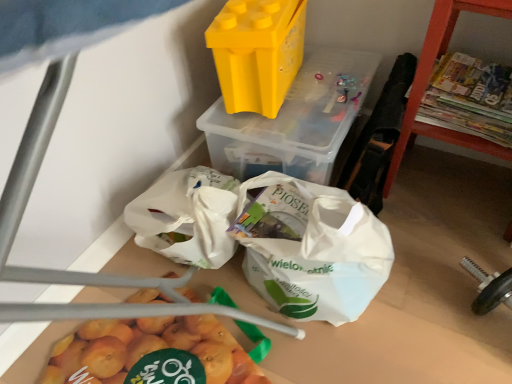
Question: Is yellow plastic container at upper center, the second yoghurt in the left-to-right sequence, positioned with its back to orange wood shelf at right?

Choices:
 (A) yes
 (B) no

Answer: (B)

Question: Are yellow plastic container at upper center, the second yoghurt in the left-to-right sequence, and orange wood shelf at right beside each other?

Choices:
 (A) no
 (B) yes

Answer: (A)

Question: Considering the relative sizes of yellow plastic container at upper center, the second yoghurt in the left-to-right sequence, and orange wood shelf at right in the image provided, is yellow plastic container at upper center, the second yoghurt in the left-to-right sequence, bigger than orange wood shelf at right?

Choices:
 (A) no
 (B) yes

Answer: (A)

Question: Is yellow plastic container at upper center, which is the 1th yoghurt from right to left, not close to orange wood shelf at right?

Choices:
 (A) yes
 (B) no

Answer: (B)

Question: Considering the relative sizes of yellow plastic container at upper center, the second yoghurt in the left-to-right sequence, and orange wood shelf at right in the image provided, is yellow plastic container at upper center, the second yoghurt in the left-to-right sequence, thinner than orange wood shelf at right?

Choices:
 (A) no
 (B) yes

Answer: (A)

Question: Considering the positions of yellow plastic container at upper center, which is the 1th yoghurt from right to left, and orange wood shelf at right in the image, is yellow plastic container at upper center, which is the 1th yoghurt from right to left, taller or shorter than orange wood shelf at right?

Choices:
 (A) tall
 (B) short

Answer: (B)

Question: From a real-world perspective, is yellow plastic container at upper center, the second yoghurt in the left-to-right sequence, positioned above or below orange wood shelf at right?

Choices:
 (A) above
 (B) below

Answer: (B)

Question: Choose the correct answer: Is yellow plastic container at upper center, which is the 1th yoghurt from right to left, inside orange wood shelf at right or outside it?

Choices:
 (A) outside
 (B) inside

Answer: (A)

Question: Considering their positions, is yellow plastic container at upper center, the second yoghurt in the left-to-right sequence, located in front of or behind orange wood shelf at right?

Choices:
 (A) behind
 (B) front

Answer: (A)

Question: Choose the correct answer: Is orange wood shelf at right inside yellow plastic container at upper center, which is the 1th yoghurt from right to left, or outside it?

Choices:
 (A) inside
 (B) outside

Answer: (B)

Question: Considering the positions of orange wood shelf at right and yellow plastic container at upper center, which is the 1th yoghurt from right to left, in the image, is orange wood shelf at right wider or thinner than yellow plastic container at upper center, which is the 1th yoghurt from right to left,?

Choices:
 (A) thin
 (B) wide

Answer: (A)

Question: Based on their positions, is orange wood shelf at right located to the left or right of yellow plastic container at upper center, which is the 1th yoghurt from right to left?

Choices:
 (A) left
 (B) right

Answer: (B)

Question: In terms of height, does orange wood shelf at right look taller or shorter compared to yellow plastic container at upper center, the second yoghurt in the left-to-right sequence?

Choices:
 (A) tall
 (B) short

Answer: (A)

Question: From the image's perspective, relative to yellow plastic container at upper center, the second yoghurt in the left-to-right sequence, is yellow plastic container at upper center, acting as the second yoghurt starting from the right, above or below?

Choices:
 (A) above
 (B) below

Answer: (A)

Question: Is yellow plastic container at upper center, marked as the first yoghurt in a left-to-right arrangement, taller or shorter than yellow plastic container at upper center, which is the 1th yoghurt from right to left?

Choices:
 (A) tall
 (B) short

Answer: (B)